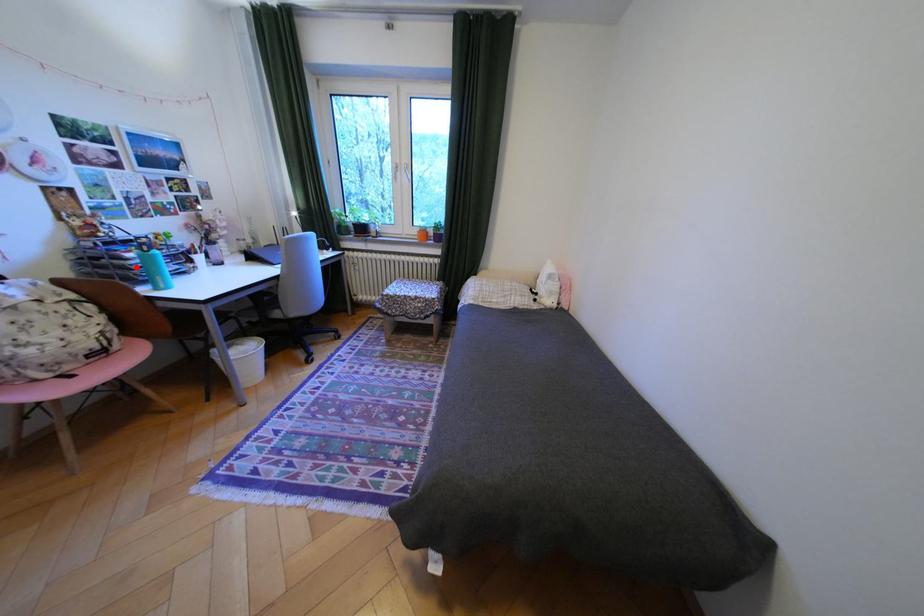
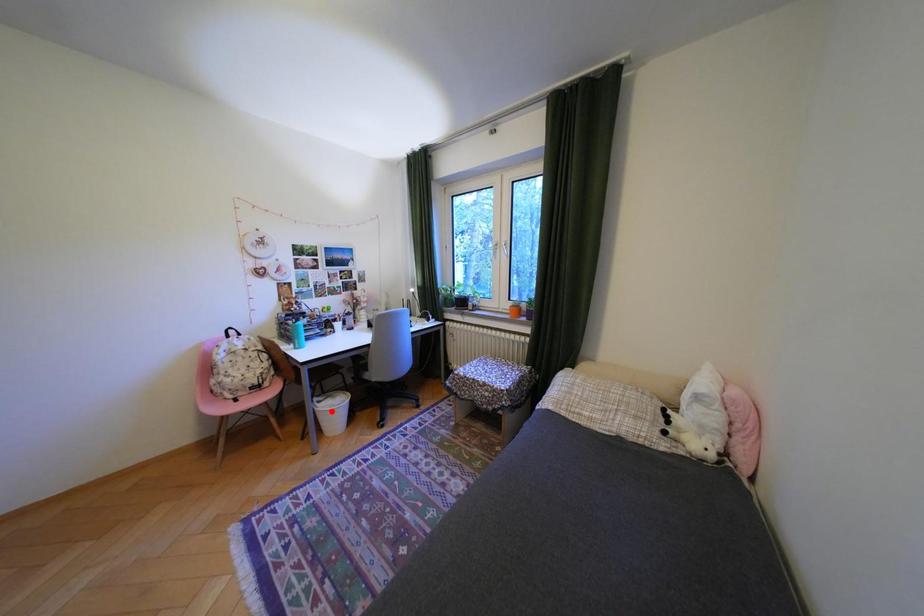
I am providing you with two images of the same scene from different viewpoints. A red point is marked on the first image and another point is marked on the second image. Are the points marked in image1 and image2 representing the same 3D position?

No